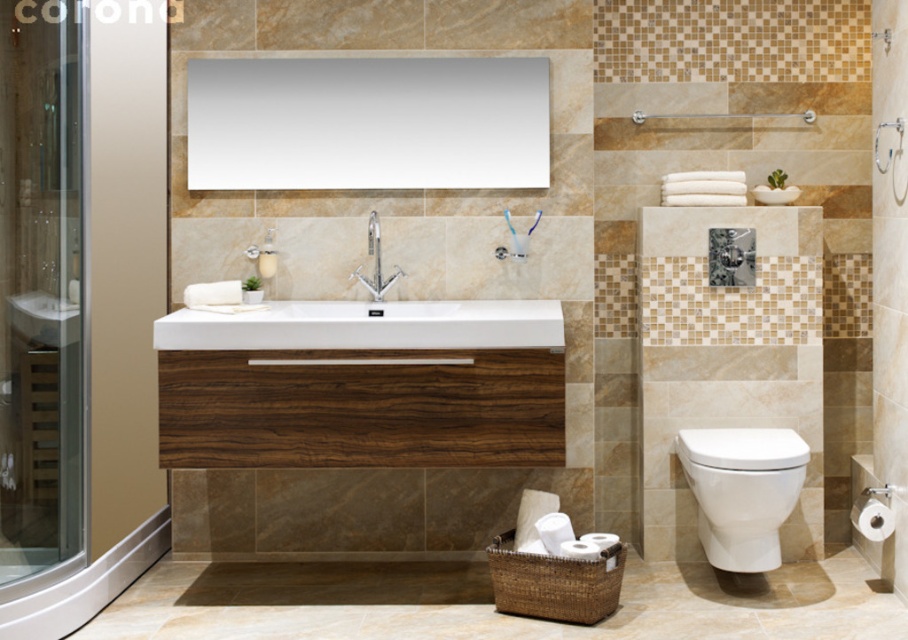
You are a contractor measuring the bathroom layout. You need to install a new shower curtain rod that must be 1 inch shorter than the height of the transparent glass screen door at right. If the matte wood shower at upper center is 6 feet tall, what should be the length of the shower curtain rod in inches?

The transparent glass screen door at right has a greater height compared to the matte wood shower at upper center. Since the matte wood shower at upper center is 6 feet tall, the transparent glass screen door at right must be taller than 6 feet. Therefore, the shower curtain rod should be 1 inch shorter than the door height. However, without knowing the exact height of the door, we cannot determine the exact length of the shower curtain rod.

From the picture: You are a delivery person who needs to place a 40 inch wide package between the transparent glass shower door at left and the white glossy sink at center. Can you fit the package in that space?

The distance between the transparent glass shower door at left and the white glossy sink at center is 38.50 inches. Since the package is 40 inches wide, it is 1.5 inches too wide to fit in the space between them.